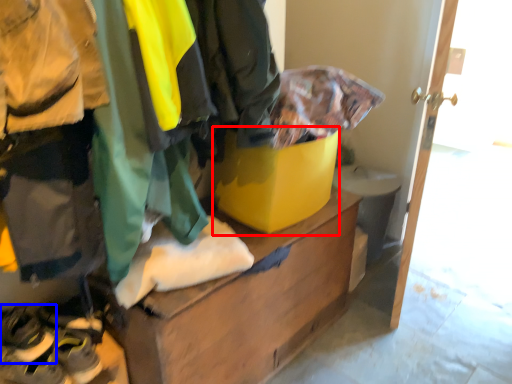
Question: Which of the following is the closest to the observer, cardboard box (highlighted by a red box) or footwear (highlighted by a blue box)?

Choices:
 (A) cardboard box
 (B) footwear

Answer: (B)